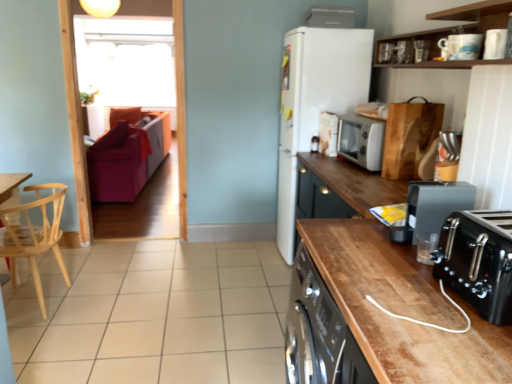
This screenshot has width=512, height=384. I want to click on vacant area located to the right-hand side of light wood chair at left, so (x=125, y=302).